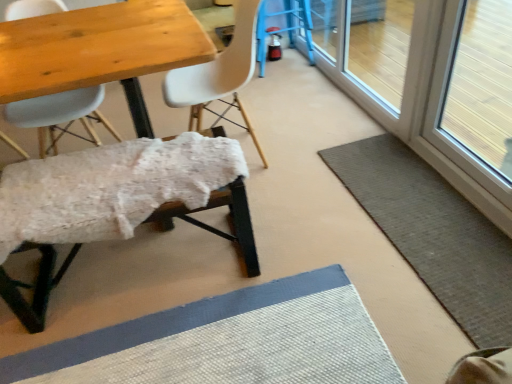
Question: Can you confirm if gray woven bath mat at lower right is taller than white fluffy bench at lower left, placed as the 2th chair when sorted from right to left?

Choices:
 (A) yes
 (B) no

Answer: (B)

Question: From the image's perspective, is gray woven bath mat at lower right above white fluffy bench at lower left, the second chair when ordered from left to right?

Choices:
 (A) no
 (B) yes

Answer: (B)

Question: Can you confirm if gray woven bath mat at lower right is smaller than white fluffy bench at lower left, the second chair when ordered from left to right?

Choices:
 (A) no
 (B) yes

Answer: (B)

Question: From the image's perspective, is gray woven bath mat at lower right below white fluffy bench at lower left, the second chair when ordered from left to right?

Choices:
 (A) no
 (B) yes

Answer: (A)

Question: Can you confirm if gray woven bath mat at lower right is thinner than white fluffy bench at lower left, placed as the 2th chair when sorted from right to left?

Choices:
 (A) yes
 (B) no

Answer: (B)

Question: Is gray woven bath mat at lower right spatially inside blue plastic bar stool at upper right, or outside of it?

Choices:
 (A) outside
 (B) inside

Answer: (A)

Question: From a real-world perspective, is gray woven bath mat at lower right positioned above or below blue plastic bar stool at upper right?

Choices:
 (A) above
 (B) below

Answer: (B)

Question: From their relative heights in the image, would you say gray woven bath mat at lower right is taller or shorter than blue plastic bar stool at upper right?

Choices:
 (A) short
 (B) tall

Answer: (A)

Question: Would you say gray woven bath mat at lower right is to the left or to the right of blue plastic bar stool at upper right in the picture?

Choices:
 (A) right
 (B) left

Answer: (A)

Question: Is transparent glass screen door at upper right spatially inside white matte chair at center, positioned as the 3th chair in left-to-right order, or outside of it?

Choices:
 (A) outside
 (B) inside

Answer: (A)

Question: In the image, is transparent glass screen door at upper right on the left side or the right side of white matte chair at center, positioned as the 3th chair in left-to-right order?

Choices:
 (A) right
 (B) left

Answer: (A)

Question: From the image's perspective, is transparent glass screen door at upper right positioned above or below white matte chair at center, positioned as the 3th chair in left-to-right order?

Choices:
 (A) below
 (B) above

Answer: (B)

Question: In terms of size, does transparent glass screen door at upper right appear bigger or smaller than white matte chair at center, positioned as the 3th chair in left-to-right order?

Choices:
 (A) small
 (B) big

Answer: (B)

Question: Is white fluffy bench at lower left, the second chair when ordered from left to right, wider or thinner than blue plastic bar stool at upper right?

Choices:
 (A) wide
 (B) thin

Answer: (B)

Question: Does point (34, 246) appear closer or farther from the camera than point (310, 59)?

Choices:
 (A) farther
 (B) closer

Answer: (B)